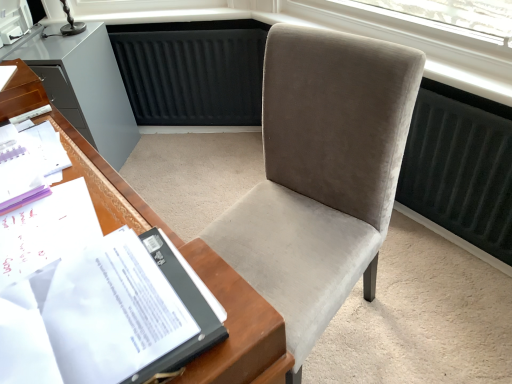
Question: In terms of height, does velvet gray chair at center look taller or shorter compared to white paper at left?

Choices:
 (A) tall
 (B) short

Answer: (A)

Question: Is velvet gray chair at center inside or outside of white paper at left?

Choices:
 (A) inside
 (B) outside

Answer: (B)

Question: Which object is positioned farthest from the white paper at left?

Choices:
 (A) velvet gray chair at center
 (B) white paper at left
 (C) matte gray cabinet at left

Answer: (C)

Question: Estimate the real-world distances between objects in this image. Which object is farther from the white paper at left?

Choices:
 (A) white paper at left
 (B) velvet gray chair at center
 (C) matte gray cabinet at left

Answer: (C)